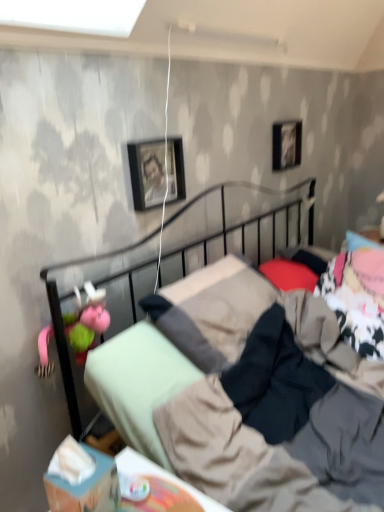
Question: From the image's perspective, is black matte picture frame at upper center, which is the 1th picture frame from bottom to top, positioned above or below pink fabric pillow at upper right, the 1th pillow from the back?

Choices:
 (A) below
 (B) above

Answer: (B)

Question: Does point (x=147, y=141) appear closer or farther from the camera than point (x=362, y=238)?

Choices:
 (A) closer
 (B) farther

Answer: (A)

Question: Which of these objects is positioned closest to the metallic black bed at center?

Choices:
 (A) blue cardboard box at lower left
 (B) pink fabric pillow at upper right, which appears as the 2th pillow when ordered from the bottom
 (C) red matte pillow at center, marked as the first pillow in a front-to-back arrangement
 (D) black matte picture frame at upper center, which is the first picture frame from left to right
 (E) pink fabric doll at left

Answer: (E)

Question: Based on their relative distances, which object is farther from the black glossy picture frame at upper right, the 1th picture frame from the top?

Choices:
 (A) pink fabric doll at left
 (B) pink fabric pillow at upper right, the 1th pillow from the back
 (C) black matte picture frame at upper center, which is the first picture frame from left to right
 (D) metallic black bed at center
 (E) blue cardboard box at lower left

Answer: (E)